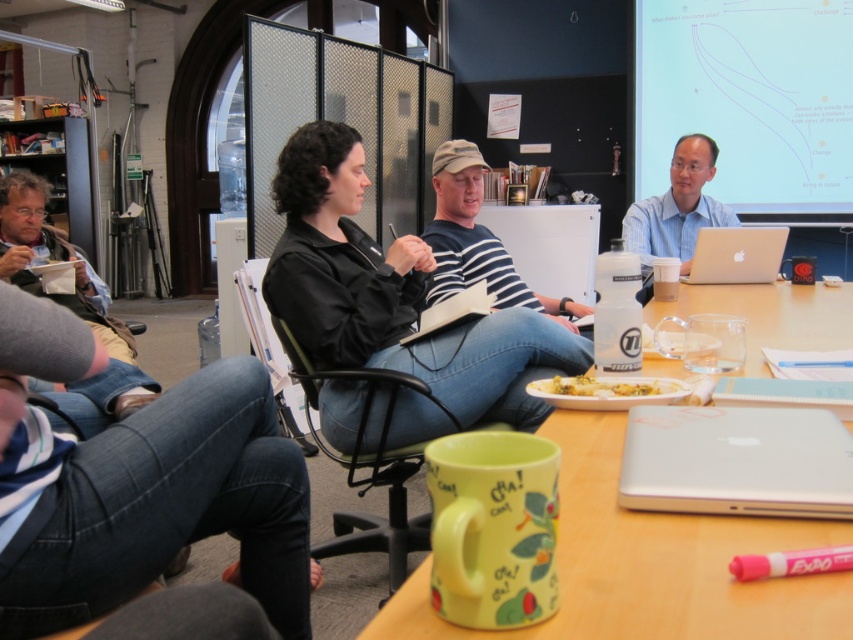
You are a person sitting at the table in the image. You want to grab the yellow ceramic mug at center. What are the coordinates where you should reach to pick it up?

The yellow ceramic mug at center is located at coordinates point (x=648, y=563), so you should reach there to pick it up.

You are a delivery person who needs to place a package between the black leather jacket at center and the silver metallic laptop at center. The package is 1.5 meters long. Can you fit it between them?

The distance between the black leather jacket at center and the silver metallic laptop at center is 1.33 meters, so the package that is 1.5 meters long cannot fit between them as it is longer than the available space.